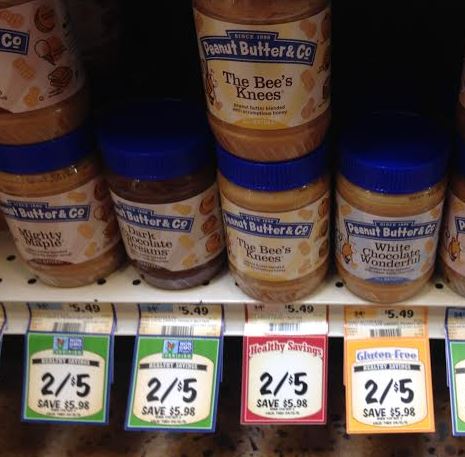
Locate an element on the screen. holes in shelf is located at coordinates (438, 287), (339, 286), (235, 285), (208, 283), (137, 283), (99, 280), (32, 281), (8, 257), (2, 280).